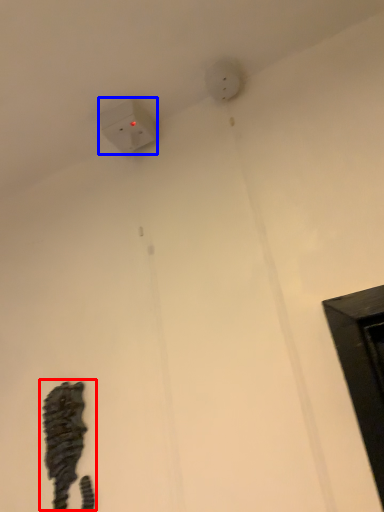
Question: Which object is closer to the camera taking this photo, animal (highlighted by a red box) or power plugs and sockets (highlighted by a blue box)?

Choices:
 (A) animal
 (B) power plugs and sockets

Answer: (A)